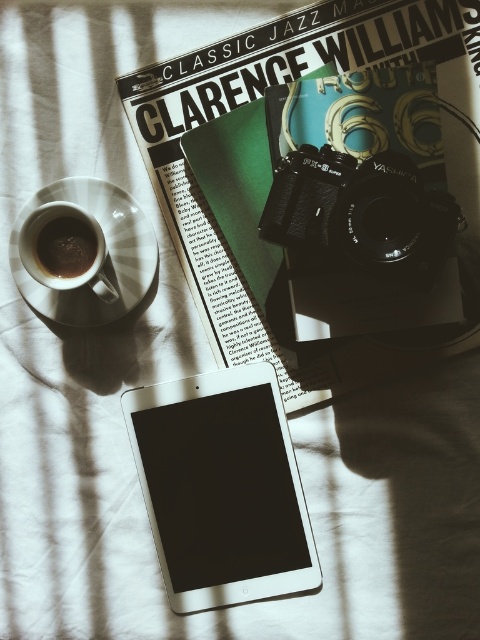
You are navigating a small drone through the scene. You need to fly from point (73, 237) to point (219, 589). Will you pass over any objects along the way?

Point (219, 589) is behind point (73, 237), so flying from point (73, 237) to point (219, 589) would mean moving towards the background. Since the scene is organized with items on a white fabric surface, there are no objects blocking the path between these two points. Therefore, the drone can fly directly between them without passing over any objects.

You are a photographer who needs to place a camera on the white fabric surface. The camera must be positioned exactly 30.58 inches away from the matte paper magazine at upper center. Is there enough space on the fabric surface to do this?

Yes, because the matte paper magazine at upper center and camera are already 30.58 inches apart from each other, so there is sufficient space to position the camera at that exact distance.

You are organizing items on a white fabric surface. You have a matte paper magazine at upper center and a silver metallic tablet at center. Which item is positioned to the right of the other?

Answer: The matte paper magazine at upper center is to the right of the silver metallic tablet at center.